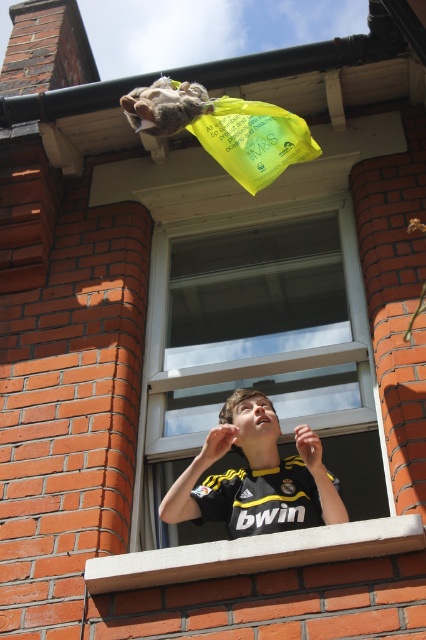
Question: Which object is the farthest from the black jersey at center?

Choices:
 (A) white concrete window sill at lower center
 (B) transparent glass window at center

Answer: (B)

Question: Which point is closer to the camera?

Choices:
 (A) (313, 140)
 (B) (114, 566)
 (C) (333, 252)

Answer: (B)

Question: Does black jersey at center appear on the right side of white concrete window sill at lower center?

Choices:
 (A) yes
 (B) no

Answer: (A)

Question: In this image, where is transparent glass window at center located relative to white concrete window sill at lower center?

Choices:
 (A) right
 (B) left

Answer: (B)

Question: Estimate the real-world distances between objects in this image. Which object is farther from the white concrete window sill at lower center?

Choices:
 (A) black jersey at center
 (B) transparent glass window at center
 (C) fuzzy fur at upper center

Answer: (C)

Question: Is transparent glass window at center below black jersey at center?

Choices:
 (A) yes
 (B) no

Answer: (B)